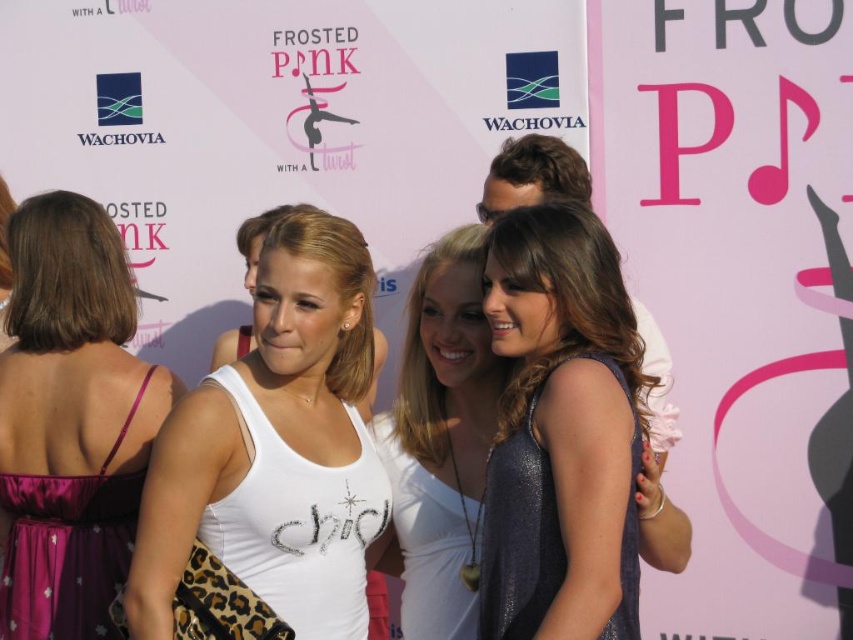
You are a photographer at the event and need to adjust the lighting to ensure both the shiny blue dress at center and the white fabric shirt at center are well lit. Considering their sizes, which one might require more focused lighting to avoid being overshadowed?

The shiny blue dress at center has a lesser height compared to the white fabric shirt at center, so it might require more focused lighting to ensure it isn not overshadowed by the taller white fabric shirt.

You are a photographer at the event and need to adjust the lighting to ensure both the shiny blue dress at center and the purple satin dress at left are well lit. Given their heights, which dress might require a lower camera angle to capture its full length?

The shiny blue dress at center has a lesser height compared to the purple satin dress at left, so the photographer should use a lower camera angle for the shiny blue dress at center to capture its full length without cropping the bottom.